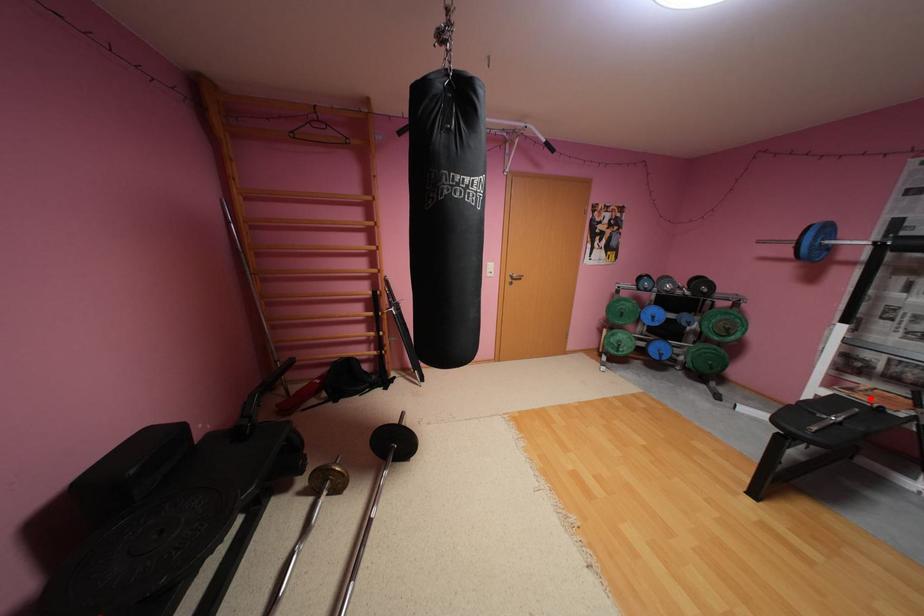
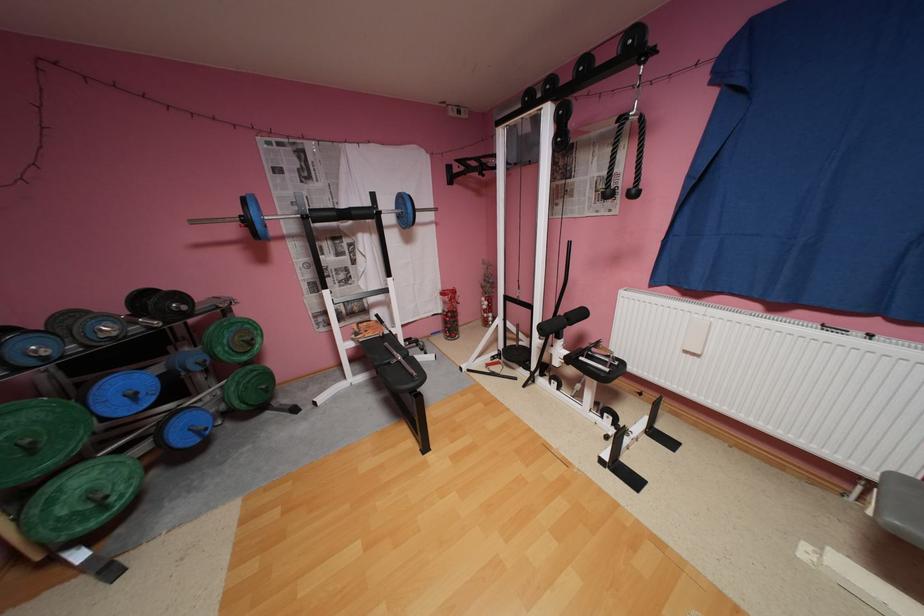
In the second image, find the point that corresponds to the highlighted location in the first image.

(380, 334)